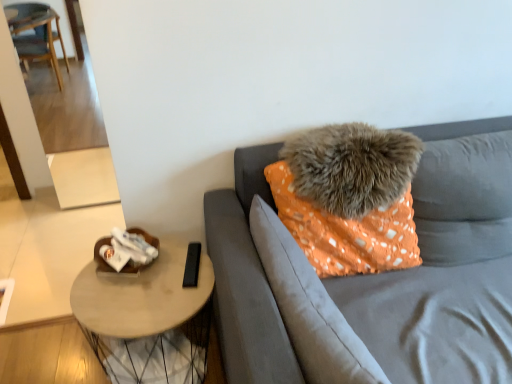
Question: From their relative heights in the image, would you say orange fabric pillow at center, the second pillow in the top-to-bottom sequence, is taller or shorter than orange fabric pillow at upper right?

Choices:
 (A) tall
 (B) short

Answer: (B)

Question: From a real-world perspective, is orange fabric pillow at center, the second pillow in the top-to-bottom sequence, physically located above or below orange fabric pillow at upper right?

Choices:
 (A) above
 (B) below

Answer: (A)

Question: Estimate the real-world distances between objects in this image. Which object is farther from the orange fabric pillow at center, the second pillow in the top-to-bottom sequence?

Choices:
 (A) orange fabric pillow at upper right
 (B) fuzzy orange pillow at center, the second pillow in the bottom-to-top sequence
 (C) light brown wooden table at lower left

Answer: (C)

Question: Which of these objects is positioned closest to the orange fabric pillow at center, the second pillow in the top-to-bottom sequence?

Choices:
 (A) light brown wooden table at lower left
 (B) fuzzy orange pillow at center, which appears as the first pillow when viewed from the top
 (C) orange fabric pillow at upper right

Answer: (C)